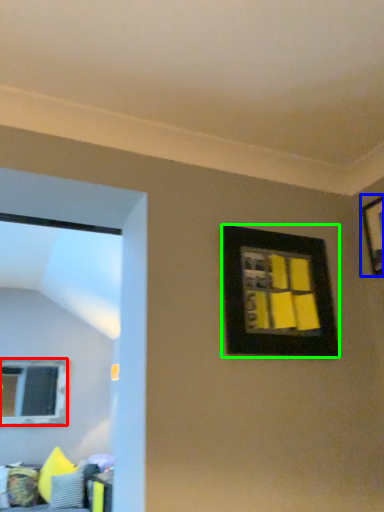
Question: Estimate the real-world distances between objects in this image. Which object is farther from window (highlighted by a red box), picture frame (highlighted by a blue box) or picture frame (highlighted by a green box)?

Choices:
 (A) picture frame
 (B) picture frame

Answer: (A)